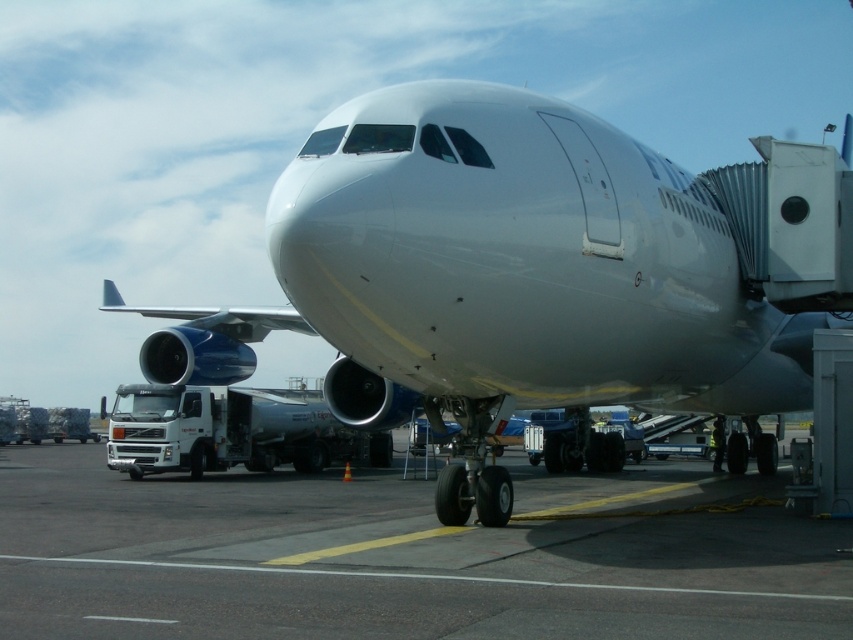
You are standing at the airport gate and looking at the airplane. There are two points marked on the aircraft. One is at coordinate point [434,273] and the other is at point [223,588]. Which point is closer to you?

Point [434,273] is closer to you because it is further to the viewer than point [223,588].

You are a pilot standing on the smooth asphalt tarmac at center. You need to board the white glossy airplane at center. Which direction should you walk to reach the airplane?

The white glossy airplane at center is bigger than the smooth asphalt tarmac at center, so you should walk towards the airplane, which is located at the center of the scene. Since both are at the center, you might need to check the exact position based on the jet bridge connection.

You are standing at the airport gate and want to locate the white glossy airplane at center. According to the coordinates given, where should you look relative to your position?

You should look towards the center of the scene since the white glossy airplane at center is located at point coordinates (543, 272).